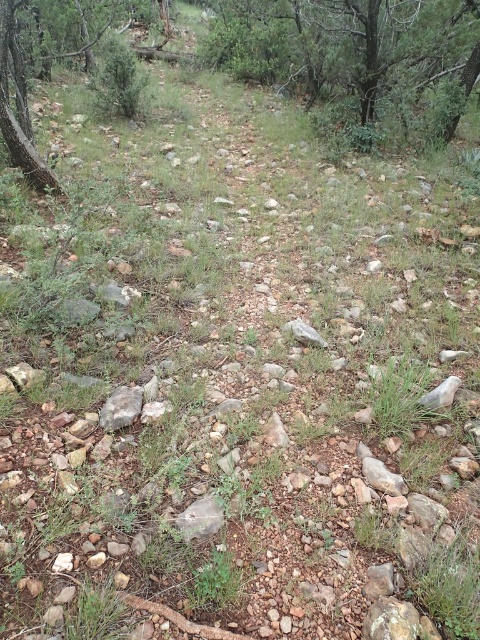
You are a hiker standing at the bottom of the image and looking upward. Which direction should you look to see the green leafy tree at upper center?

The green leafy tree at upper center is located at point (x=357, y=58), so you should look upward and slightly to the left to see it.

You are a hiker standing on the rocky path and looking at the green leafy tree at upper center and the gray rock at center. Which object is higher in height?

The green leafy tree at upper center is taller than the gray rock at center.